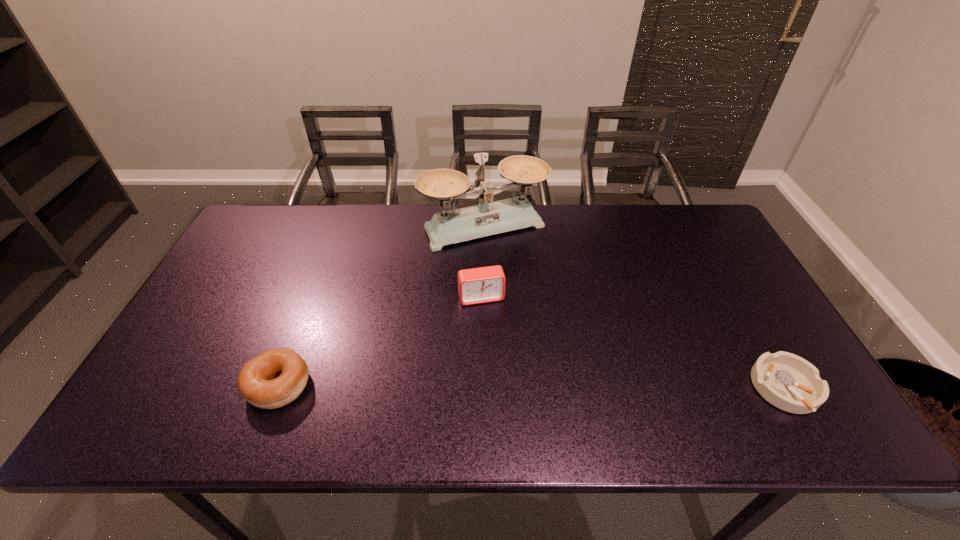
At what (x,y) coordinates should I click in order to perform the action: click on the leftmost object. Please return your answer as a coordinate pair (x, y). Looking at the image, I should click on (256, 383).

You are a GUI agent. You are given a task and a screenshot of the screen. Output one action in this format:
    pyautogui.click(x=<x>, y=<y>)
    Task: Click on the third tallest object
    This screenshot has height=540, width=960.
    Given the screenshot: What is the action you would take?
    pyautogui.click(x=256, y=383)

Image resolution: width=960 pixels, height=540 pixels. Find the location of `the shortest object`. the shortest object is located at coordinates (787, 381).

The image size is (960, 540). I want to click on ashtray, so click(x=787, y=381).

Locate an element on the screen. the third nearest object is located at coordinates (485, 284).

Image resolution: width=960 pixels, height=540 pixels. In order to click on alarm clock in this screenshot , I will do `click(485, 284)`.

Identify the location of scale. The height and width of the screenshot is (540, 960). (488, 218).

Find the location of a particular element. The image size is (960, 540). the tallest object is located at coordinates (488, 218).

Where is `free space located 0.150m on the back of the bagel`? free space located 0.150m on the back of the bagel is located at coordinates (305, 313).

I want to click on free space located on the left of the shortest object, so click(x=667, y=388).